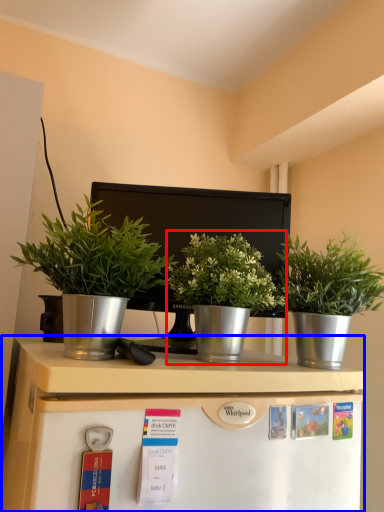
Question: Which point is further to the camera, houseplant (highlighted by a red box) or table (highlighted by a blue box)?

Choices:
 (A) houseplant
 (B) table

Answer: (A)